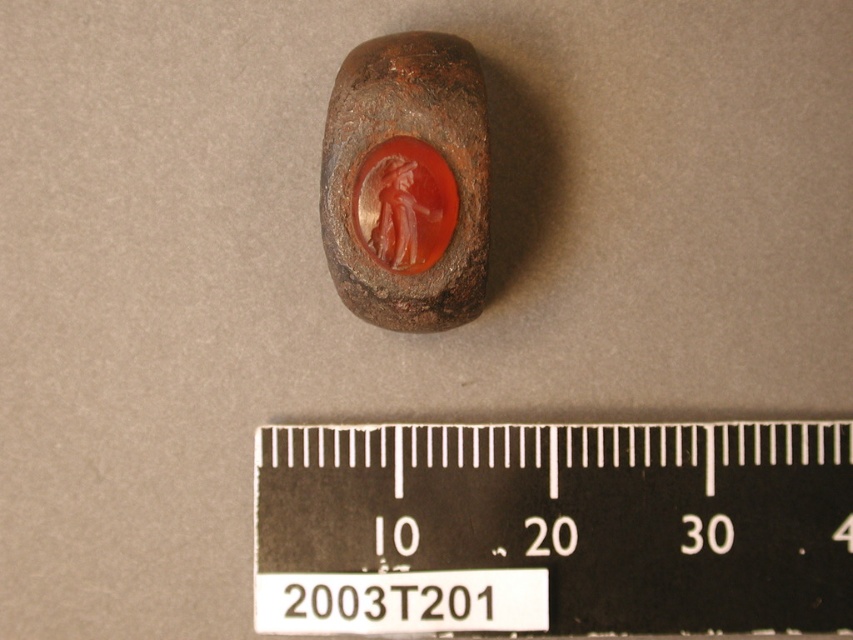
Question: Considering the real-world distances, which object is closest to the black plastic ruler at center?

Choices:
 (A) matte brown stone at center
 (B) translucent orange gemstone at center

Answer: (A)

Question: Does black plastic ruler at center appear over matte brown stone at center?

Choices:
 (A) yes
 (B) no

Answer: (B)

Question: Which point is closer to the camera?

Choices:
 (A) (360, 241)
 (B) (397, 125)
 (C) (670, 426)

Answer: (B)

Question: Can you confirm if matte brown stone at center is smaller than translucent orange gemstone at center?

Choices:
 (A) no
 (B) yes

Answer: (A)

Question: Estimate the real-world distances between objects in this image. Which object is farther from the black plastic ruler at center?

Choices:
 (A) translucent orange gemstone at center
 (B) matte brown stone at center

Answer: (A)

Question: Considering the relative positions of black plastic ruler at center and matte brown stone at center in the image provided, where is black plastic ruler at center located with respect to matte brown stone at center?

Choices:
 (A) above
 (B) below

Answer: (B)